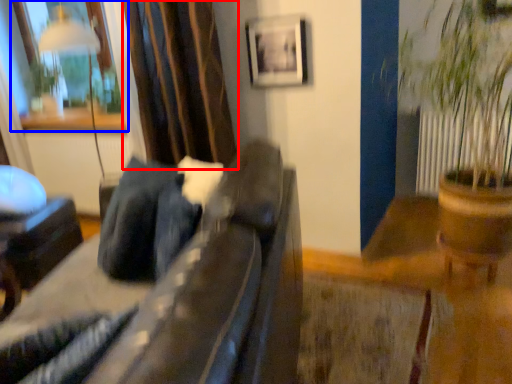
Question: Among these objects, which one is farthest to the camera, curtain (highlighted by a red box) or window (highlighted by a blue box)?

Choices:
 (A) curtain
 (B) window

Answer: (B)